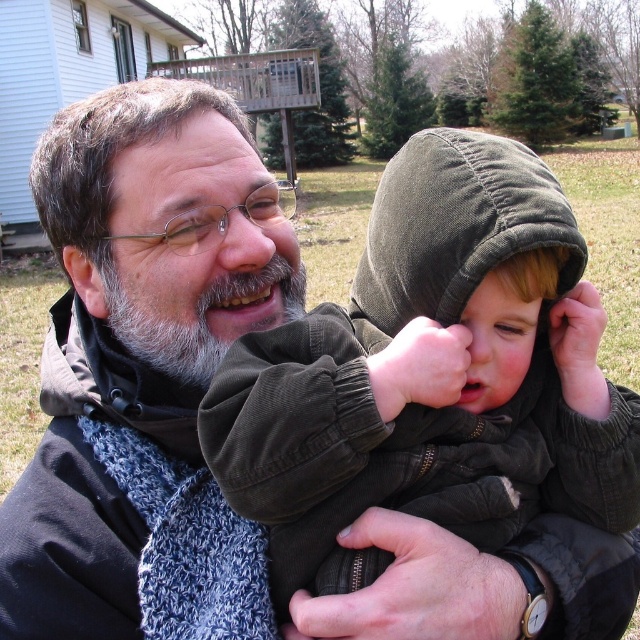
Question: Which object is closer to the camera taking this photo?

Choices:
 (A) dark green corduroy hoodie at center
 (B) knitted scarf at center

Answer: (A)

Question: Is knitted scarf at center above dark green corduroy hoodie at center?

Choices:
 (A) no
 (B) yes

Answer: (B)

Question: Which of the following is the closest to the observer?

Choices:
 (A) (100, 532)
 (B) (545, 330)
 (C) (234, 330)

Answer: (A)

Question: In this image, where is dark green corduroy hoodie at center located relative to graybeard at center?

Choices:
 (A) below
 (B) above

Answer: (A)

Question: Is dark green corduroy hoodie at center thinner than graybeard at center?

Choices:
 (A) no
 (B) yes

Answer: (A)

Question: Estimate the real-world distances between objects in this image. Which object is closer to the graybeard at center?

Choices:
 (A) knitted scarf at center
 (B) dark green corduroy hoodie at center

Answer: (A)